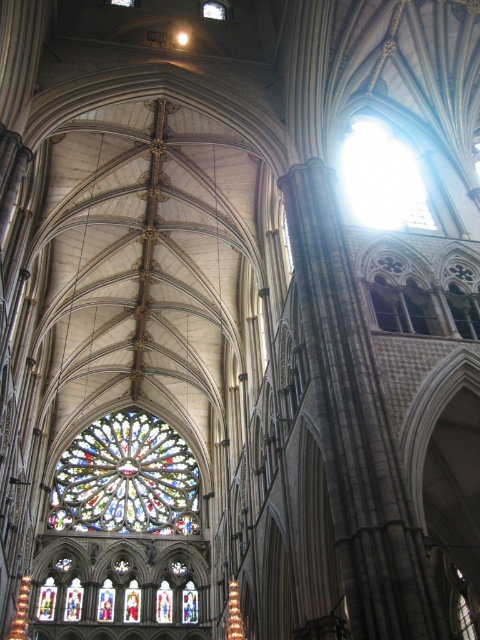
Does multicolored stained glass at center appear under transparent glass at upper center?

Correct, multicolored stained glass at center is located below transparent glass at upper center.

Is point (149, 532) behind point (374, 211)?

Yes, it is.

Locate an element on the screen. The height and width of the screenshot is (640, 480). multicolored stained glass at center is located at coordinates (126, 477).